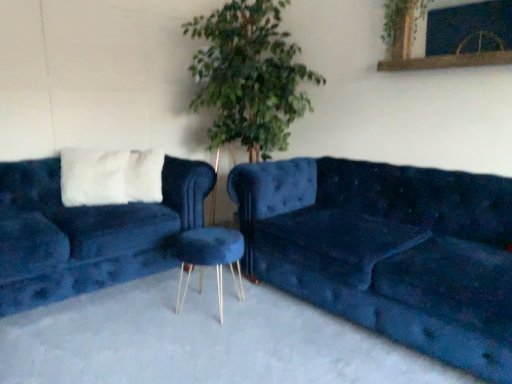
Question: Is velvet blue couch at right, which is counted as the second studio couch, starting from the left, situated inside velvet blue couch at left, arranged as the 1th studio couch when viewed from the left, or outside?

Choices:
 (A) outside
 (B) inside

Answer: (A)

Question: Looking at the image, does velvet blue couch at right, which is counted as the second studio couch, starting from the left, seem bigger or smaller compared to velvet blue couch at left, acting as the second studio couch starting from the right?

Choices:
 (A) big
 (B) small

Answer: (A)

Question: Considering the real-world distances, which object is closest to the green leafy plant at upper center?

Choices:
 (A) velvet blue stool at center
 (B) velvet blue couch at left, acting as the second studio couch starting from the right
 (C) velvet blue couch at right, which appears as the first studio couch when viewed from the right

Answer: (C)

Question: Which is farther from the velvet blue couch at left, arranged as the 1th studio couch when viewed from the left?

Choices:
 (A) velvet blue couch at right, which appears as the first studio couch when viewed from the right
 (B) velvet blue stool at center
 (C) green leafy plant at upper center

Answer: (C)